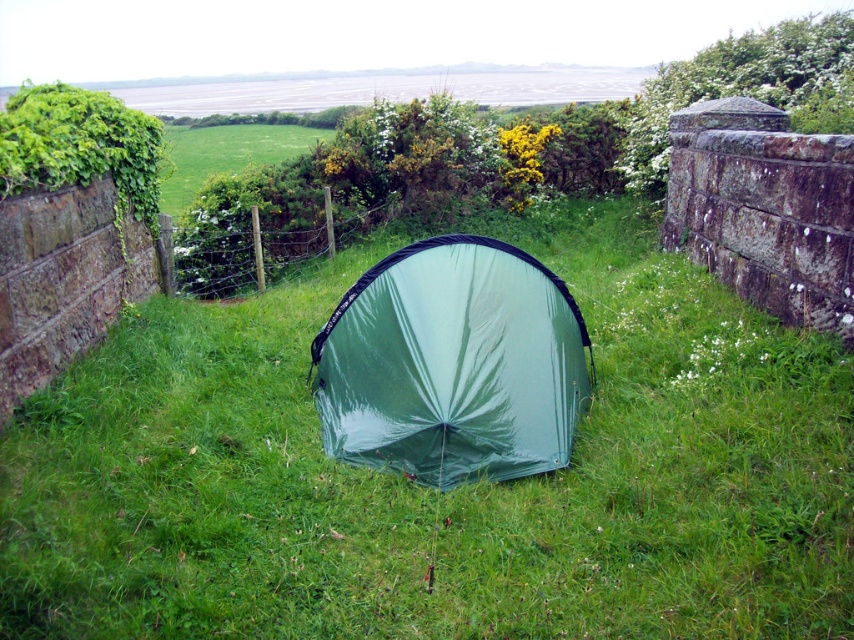
Who is positioned more to the right, green fabric tent at center or green grassy field at center?

Positioned to the right is green fabric tent at center.

Does green fabric tent at center appear over green grassy field at center?

No.

Which is in front, point (580, 541) or point (205, 129)?

Point (580, 541)

Identify the location of green fabric tent at center. (434, 490).

Who is positioned more to the left, green fabric tent at center or green shiny tent at center?

green fabric tent at center

Is green fabric tent at center to the right of green shiny tent at center from the viewer's perspective?

Incorrect, green fabric tent at center is not on the right side of green shiny tent at center.

This screenshot has width=854, height=640. In order to click on green fabric tent at center in this screenshot , I will do `click(434, 490)`.

Is point (390, 356) positioned in front of point (316, 129)?

Yes.

Between green shiny tent at center and green grassy field at center, which one is positioned higher?

green grassy field at center is higher up.

Between point (459, 365) and point (184, 131), which one is positioned behind?

Point (184, 131)

Where is `green shiny tent at center`? This screenshot has height=640, width=854. green shiny tent at center is located at coordinates (452, 364).